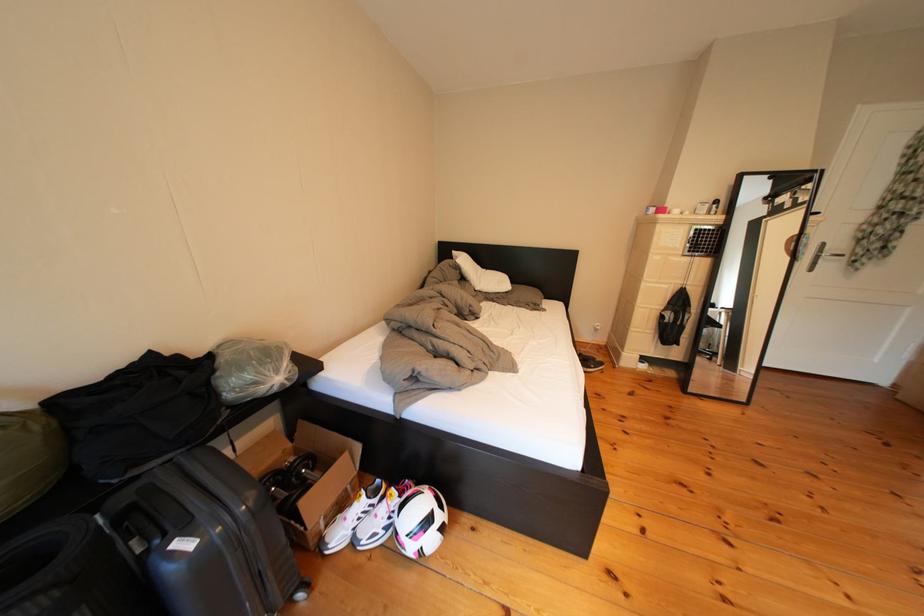
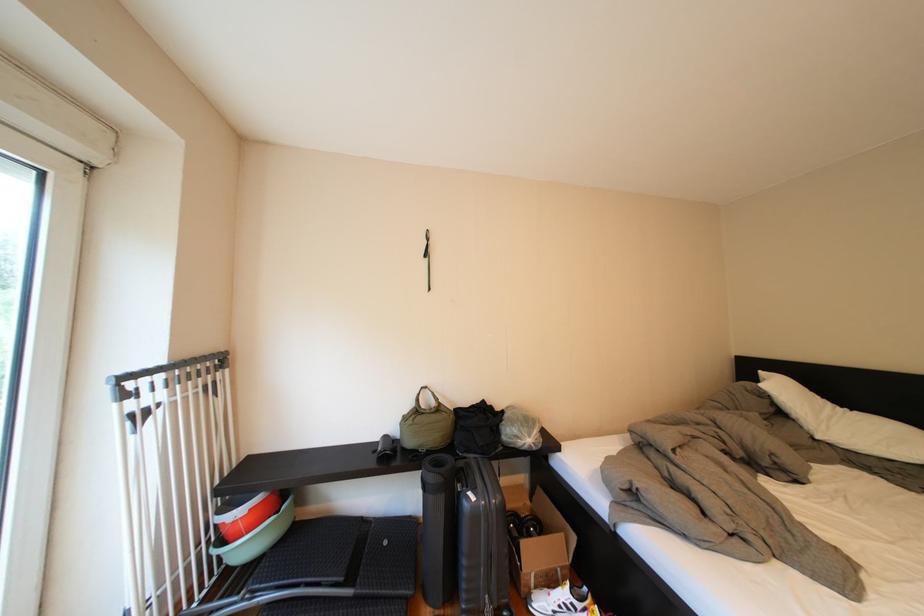
Where in the second image is the point corresponding to point (203, 551) from the first image?

(487, 503)